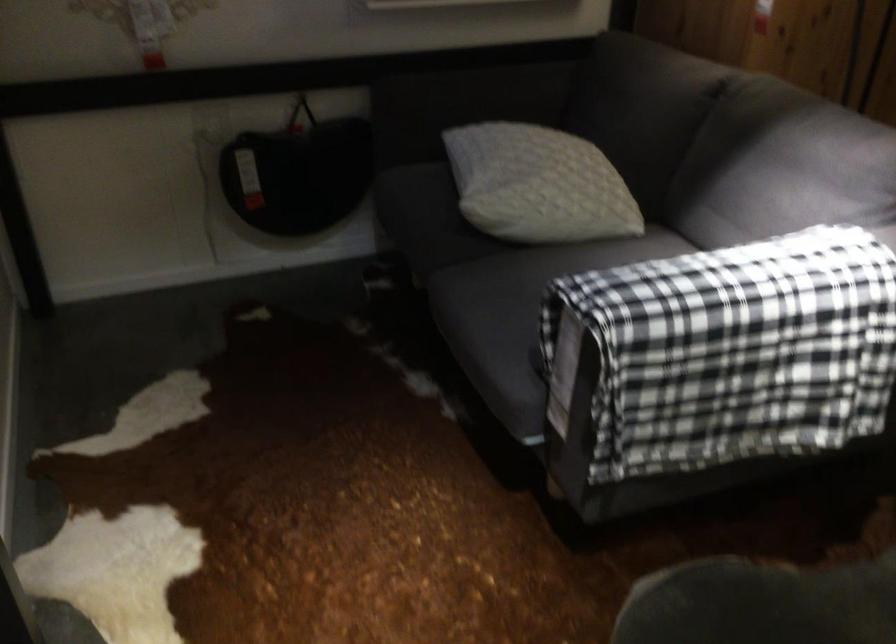
Identify the location of sofa sitting surface. The height and width of the screenshot is (644, 896). pos(504,292).